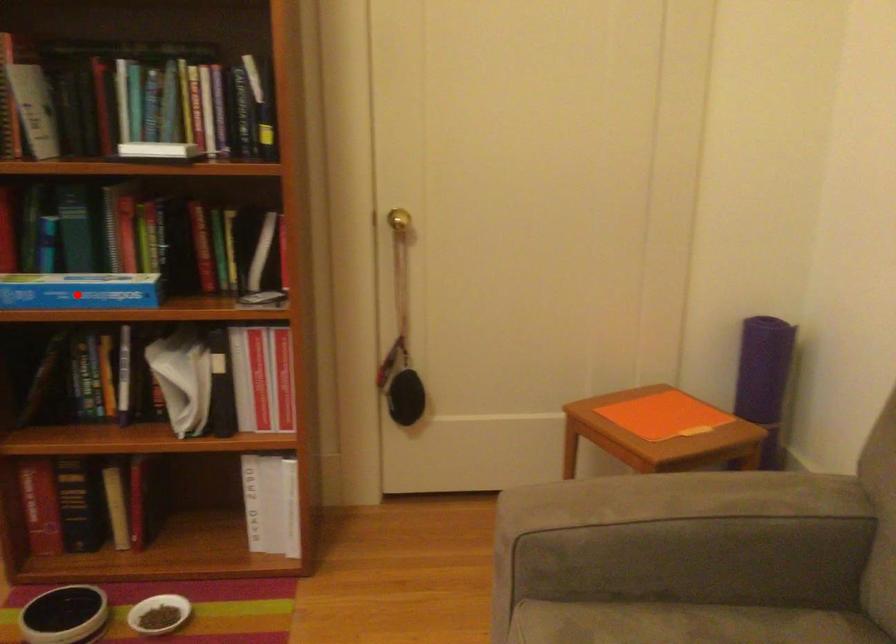
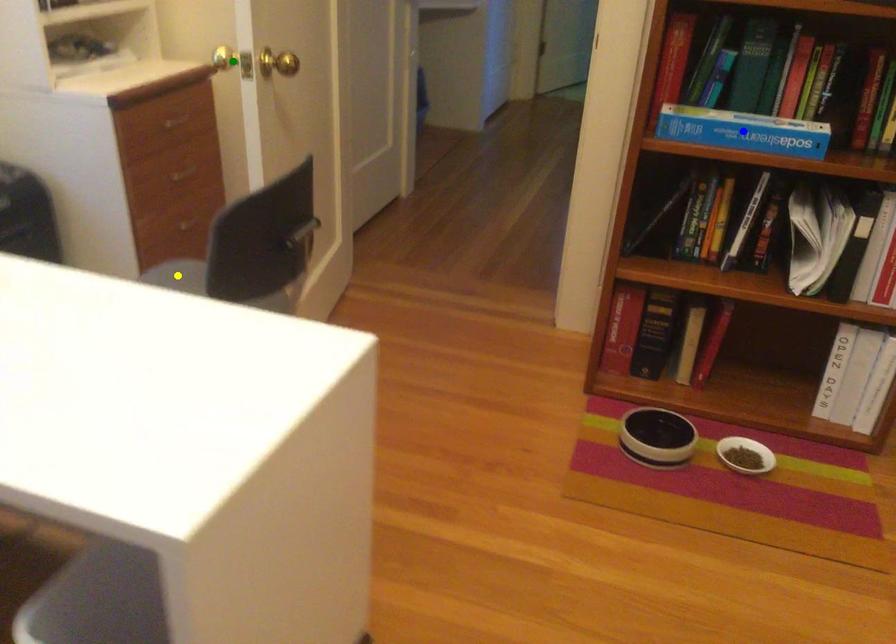
Question: I am providing you with two images of the same scene from different viewpoints. A red point is marked on the first image. You are given multiple points on the second image. Which point in image 2 represents the same 3d spot as the red point in image 1?

Choices:
 (A) green point
 (B) yellow point
 (C) blue point

Answer: (C)